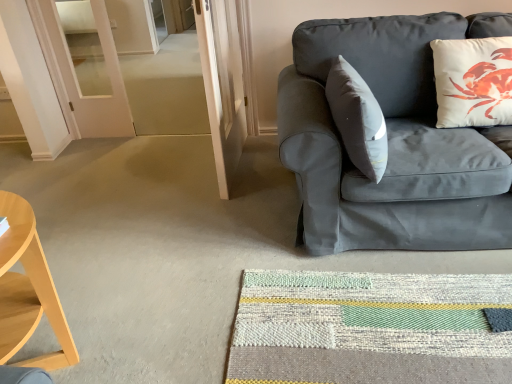
Question: From the image's perspective, is matte gray couch at right above or below light wood/wooden desk at left?

Choices:
 (A) above
 (B) below

Answer: (A)

Question: Is matte gray couch at right wider or thinner than light wood/wooden desk at left?

Choices:
 (A) thin
 (B) wide

Answer: (B)

Question: Which of these objects is positioned closest to the textured woven mat at lower center?

Choices:
 (A) white matte pillow at upper right
 (B) matte gray couch at right
 (C) light wood/wooden desk at left

Answer: (B)

Question: Considering the real-world distances, which object is closest to the textured woven mat at lower center?

Choices:
 (A) matte gray couch at right
 (B) light wood/wooden desk at left
 (C) white matte pillow at upper right

Answer: (A)